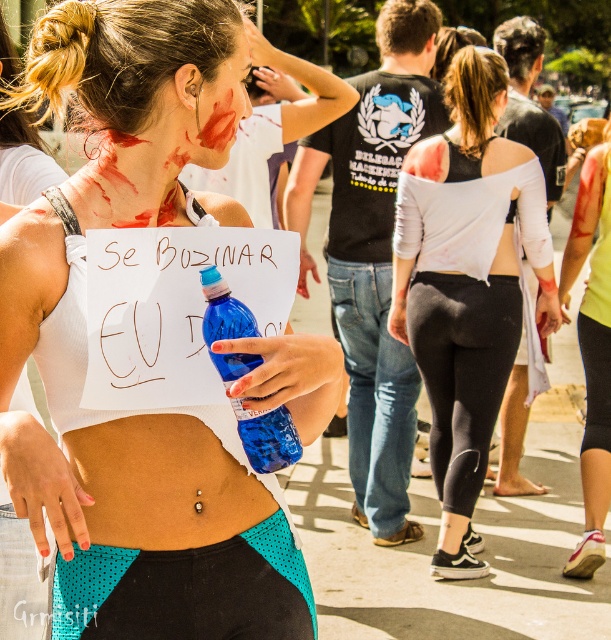
Based on the scene description, which clothing item is positioned higher on the person wearing them, the matte white tank top at center or the yellow fabric shirt at center?

The matte white tank top at center is positioned higher than the yellow fabric shirt at center according to the description.

You are a photographer standing at the scene. You want to take a closeup shot of the matte white tank top at center without including any other objects in the frame. Given your current position, can you achieve this?

The matte white tank top at center and camera are 4.96 feet apart from each other. Since the distance is sufficient and no other objects are mentioned to obstruct the view, you can adjust your lens or move closer if needed to capture the closeup without including other objects.

What is the exact coordinate of the matte white tank top at center?

The matte white tank top at center is located at point (86, 348).